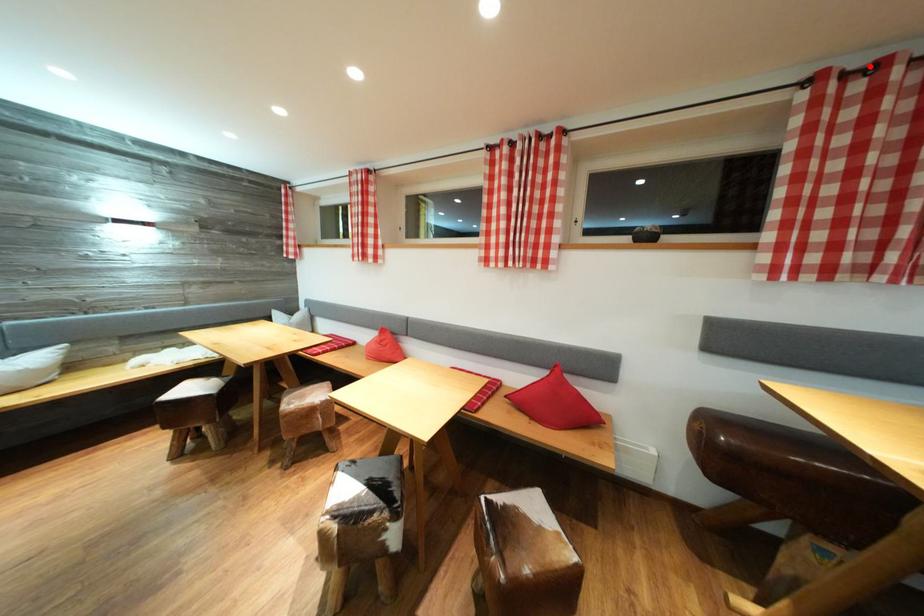
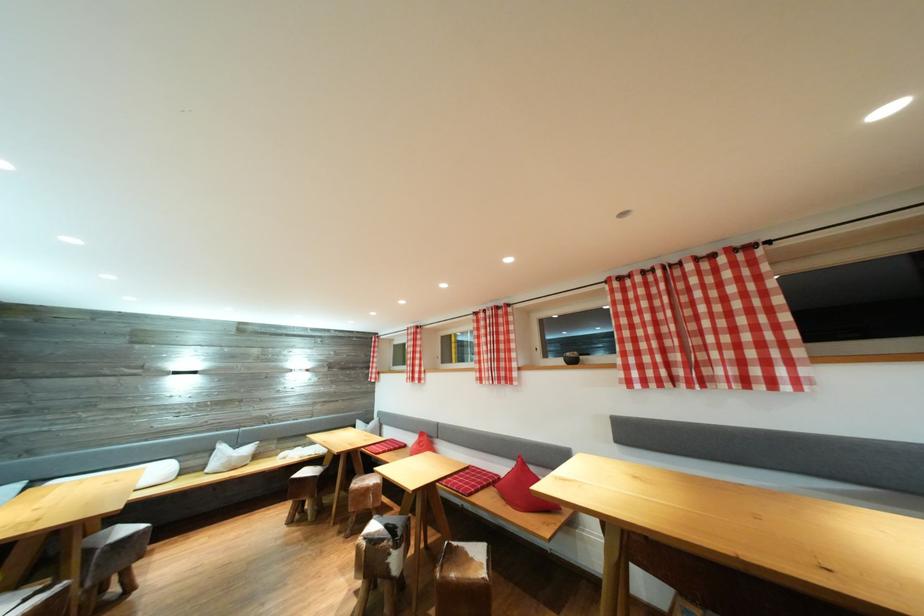
Locate, in the second image, the point that corresponds to the highlighted location in the first image.

(631, 278)